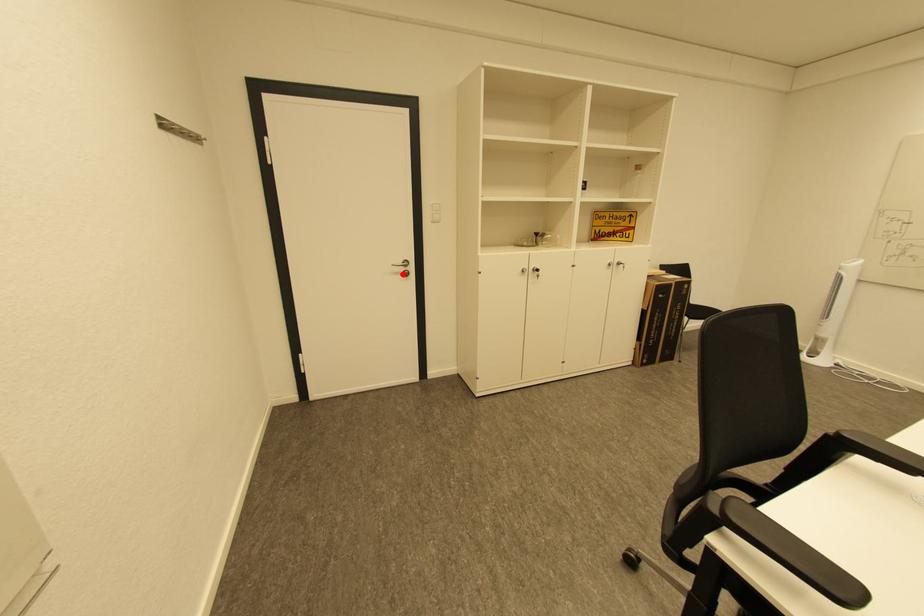
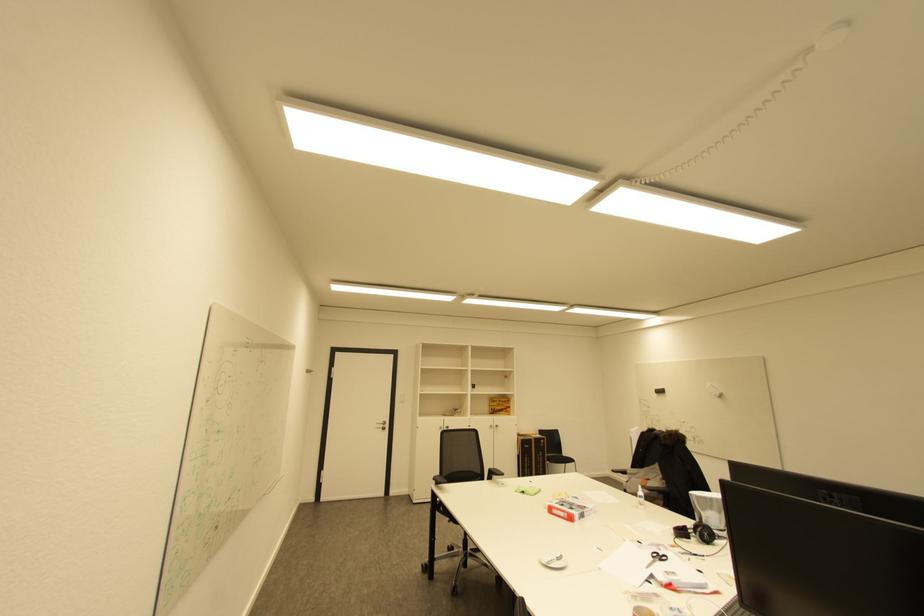
Find the pixel in the second image that matches the highlighted location in the first image.

(385, 429)